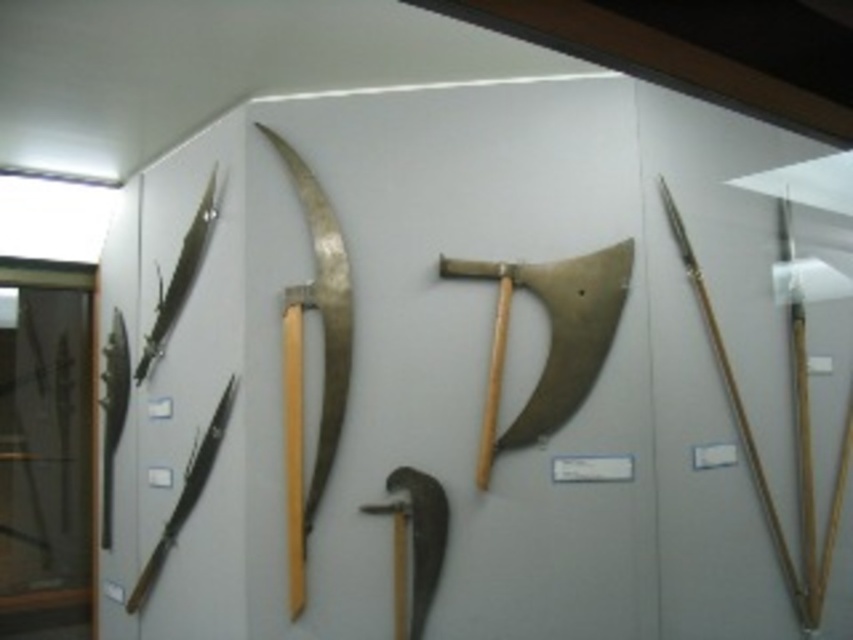
Question: Which of the following is the closest to the observer?

Choices:
 (A) (434, 545)
 (B) (202, 472)
 (C) (595, 252)

Answer: (A)

Question: Is wooden spear at right smaller than shiny silver sword at upper left?

Choices:
 (A) no
 (B) yes

Answer: (A)

Question: Which object appears farthest from the camera in this image?

Choices:
 (A) shiny silver sword at upper left
 (B) wooden spear at right
 (C) polished silver scythe at center
 (D) gold metallic axe at center

Answer: (A)

Question: Is gold metallic axe at center positioned in front of shiny silver sword at upper left?

Choices:
 (A) no
 (B) yes

Answer: (B)

Question: Which point is closer to the camera taking this photo?

Choices:
 (A) (679, 248)
 (B) (416, 596)

Answer: (B)

Question: Can you confirm if polished silver scythe at center is smaller than shiny metallic spear at left?

Choices:
 (A) yes
 (B) no

Answer: (A)